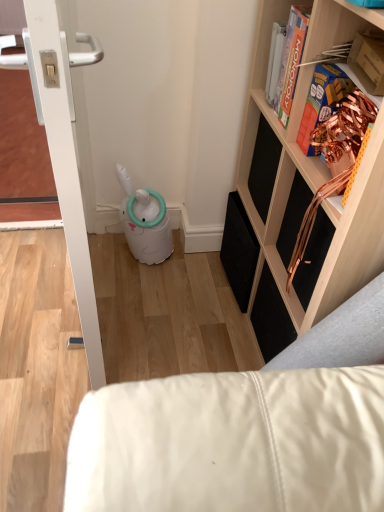
The image size is (384, 512). In order to click on blank area beneath white glossy door at left (from a real-world perspective) in this screenshot , I will do `click(96, 310)`.